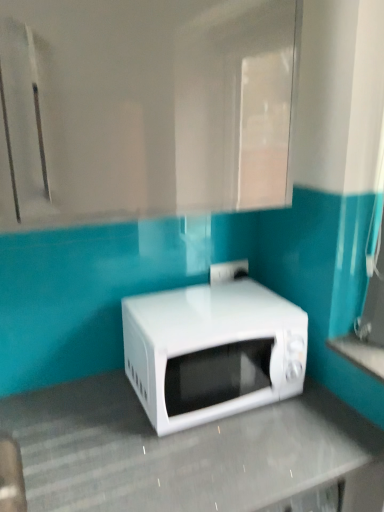
Locate an element on the screen. vacant region above white glossy microwave at center (from a real-world perspective) is located at coordinates (210, 302).